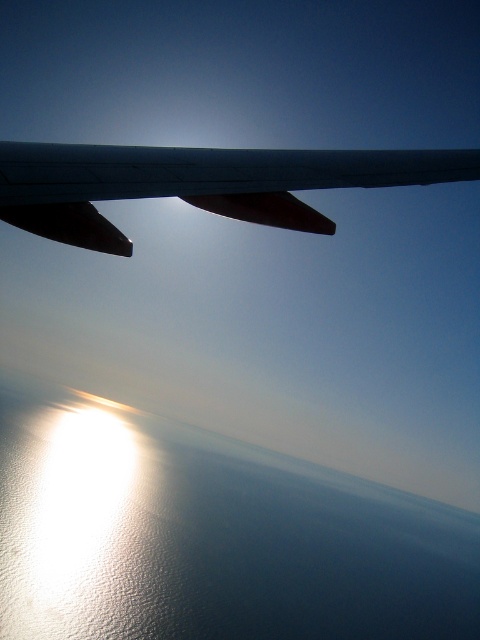
You are a passenger sitting in the aircraft and want to know how far the point at coordinates point (x=159, y=476) is from your seat. Can you determine the distance?

The point (x=159, y=476) is 276.41 meters from the viewer, so the distance from your seat to that point is 276.41 meters.